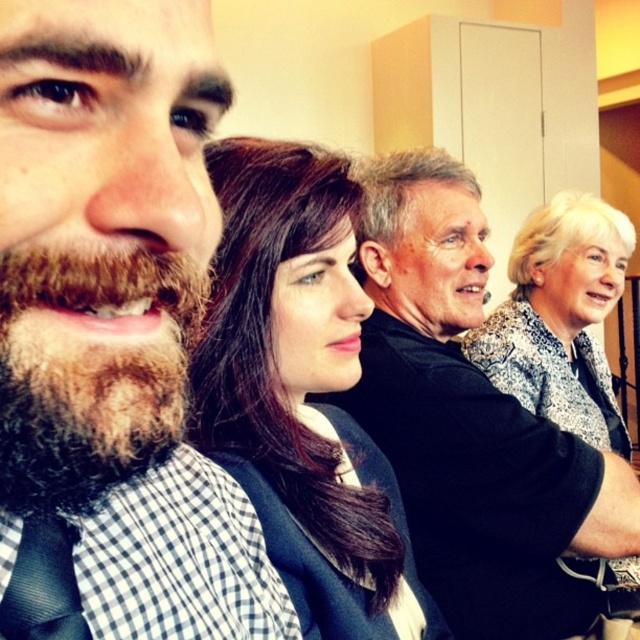
Who is higher up, black matte shirt at center or white printed blouse at upper right?

Positioned higher is white printed blouse at upper right.

Does black matte shirt at center have a smaller size compared to white printed blouse at upper right?

Indeed, black matte shirt at center has a smaller size compared to white printed blouse at upper right.

The width and height of the screenshot is (640, 640). I want to click on black matte shirt at center, so click(x=472, y=422).

At what (x,y) coordinates should I click in order to perform the action: click on black matte shirt at center. Please return your answer as a coordinate pair (x, y). The width and height of the screenshot is (640, 640). Looking at the image, I should click on (472, 422).

Between black matte shirt at center and dark brown hair at center, which one is positioned lower?

black matte shirt at center is lower down.

What do you see at coordinates (472, 422) in the screenshot? I see `black matte shirt at center` at bounding box center [472, 422].

At what (x,y) coordinates should I click in order to perform the action: click on black matte shirt at center. Please return your answer as a coordinate pair (x, y). This screenshot has height=640, width=640. Looking at the image, I should click on (472, 422).

Does dark brown hair at center appear over white printed blouse at upper right?

No.

The height and width of the screenshot is (640, 640). Find the location of `dark brown hair at center`. dark brown hair at center is located at coordinates (300, 392).